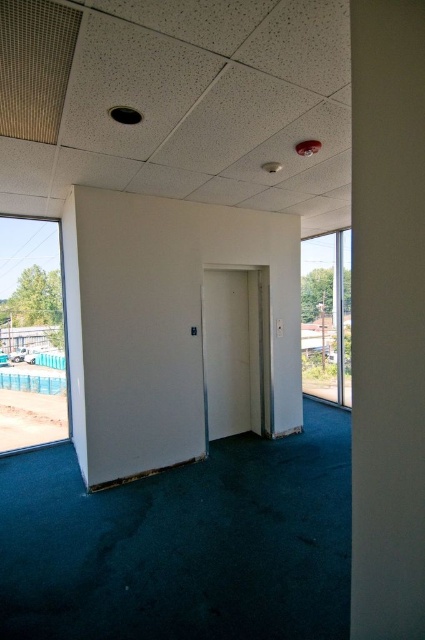
You are an office worker who needs to exit the office quickly. You see the white matte door at center and the transparent glass window at right. Which exit point is larger in size?

The transparent glass window at right is larger than the white matte door at center, so the window is the larger exit point.

You are standing in an office space and want to know the distance to a specific point marked as point (56, 376). Can you tell me how far it is from your current position?

The point (56, 376) is 8.66 meters away from the viewer.

You are a delivery person carrying a box that is 3 meters long. You are standing near the blue plastic pool at lower left and need to move it to the white smooth pillar at right. Can you move the box horizontally without tilting it, considering the space between them?

The distance between the blue plastic pool at lower left and the white smooth pillar at right is 8.04 meters. Since the box is 3 meters long, there is enough space to move it horizontally without tilting.